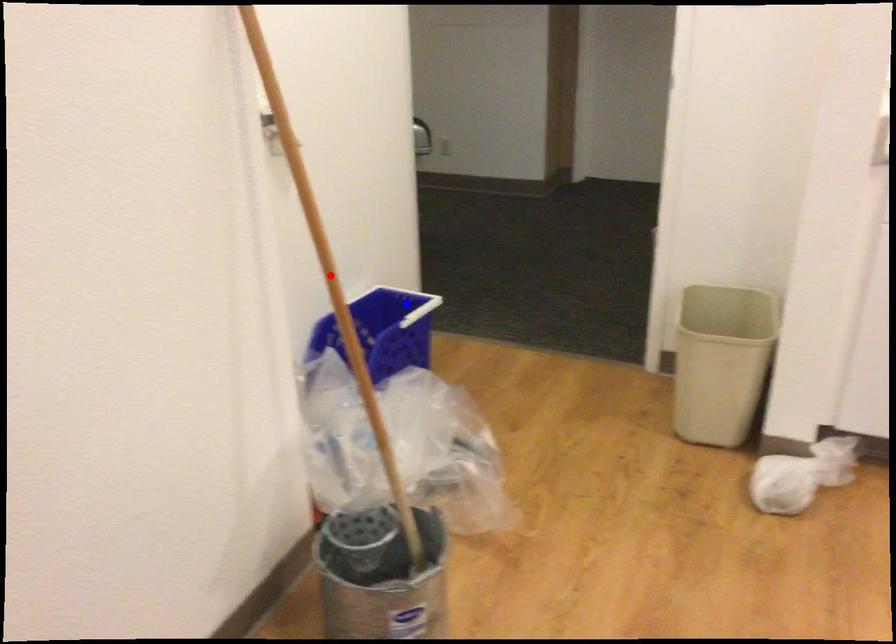
Question: In the image, two points are highlighted. Which point is nearer to the camera? Reply with the corresponding letter.

Choices:
 (A) blue point
 (B) red point

Answer: (B)